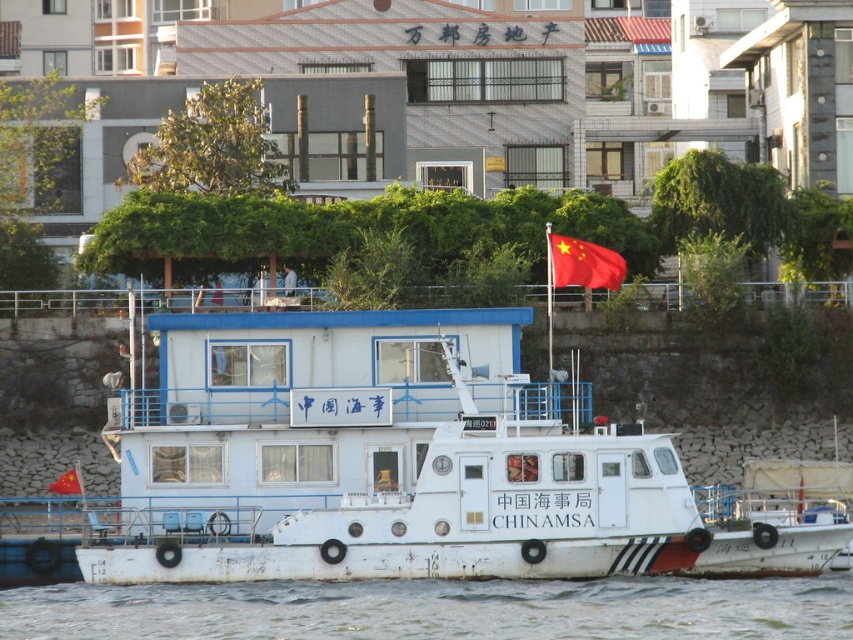
You are standing on the riverside and see the white matte water at lower center and the red fabric flag at center. Which object is located below the other?

The white matte water at lower center is positioned under the red fabric flag at center, so the white matte water at lower center is below the red fabric flag at center.

You are a drone operator tasked with capturing aerial footage of the white matte boat at center. The boat is located at point (442, 509). To ensure the boat is centered in the frame, where should you position the drone relative to the boat?

The white matte boat at center is represented by point (442, 509), so the drone should be positioned directly above this point to center the boat in the frame.

You are a photographer trying to capture the white matte boat at center and the red fabric flag at upper center in a single frame. Based on their heights, which object should you focus on first to ensure both are fully visible in the photo?

The white matte boat at center is taller than the red fabric flag at upper center, so you should focus on the white matte boat at center first to ensure both are fully visible in the photo.